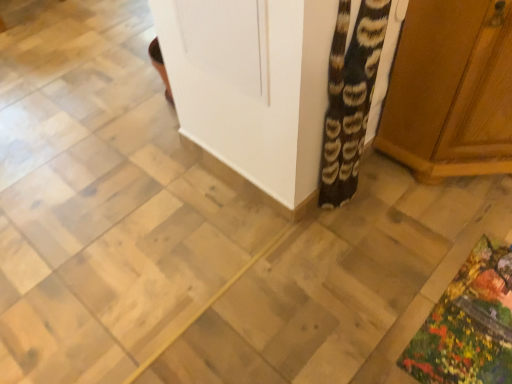
What are the coordinates of `free point to the right of black and white patterned blanket at center` in the screenshot? It's located at (393, 199).